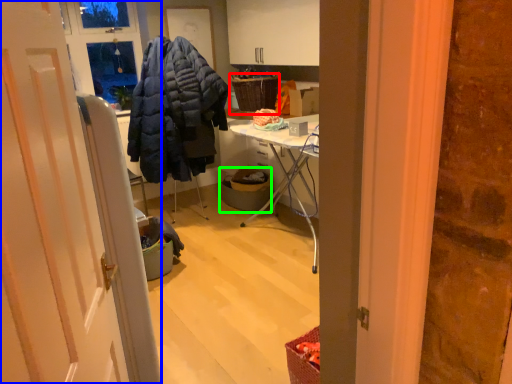
Question: Based on their relative distances, which object is farther from picnic basket (highlighted by a red box)? Choose from door (highlighted by a blue box) and trash bin/can (highlighted by a green box).

Choices:
 (A) door
 (B) trash bin/can

Answer: (A)